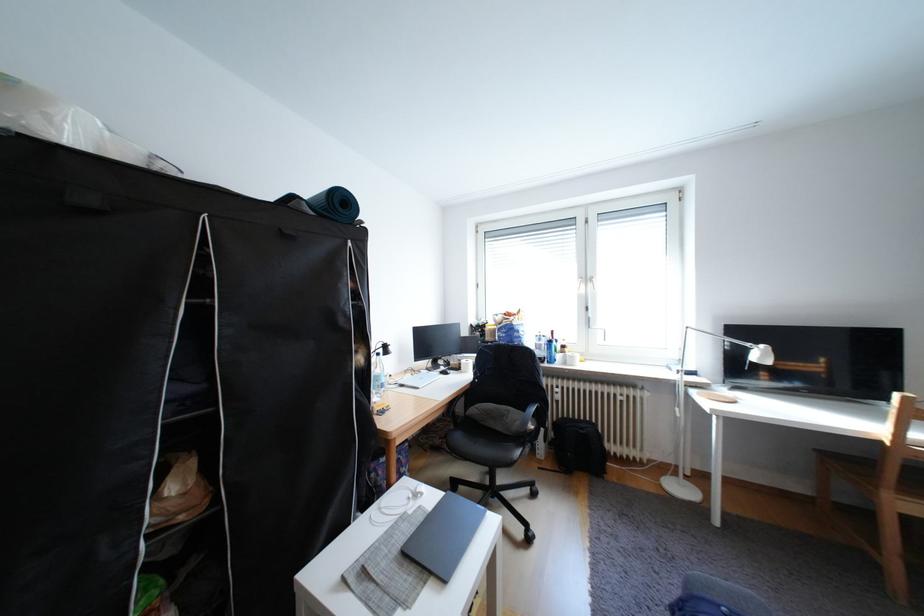
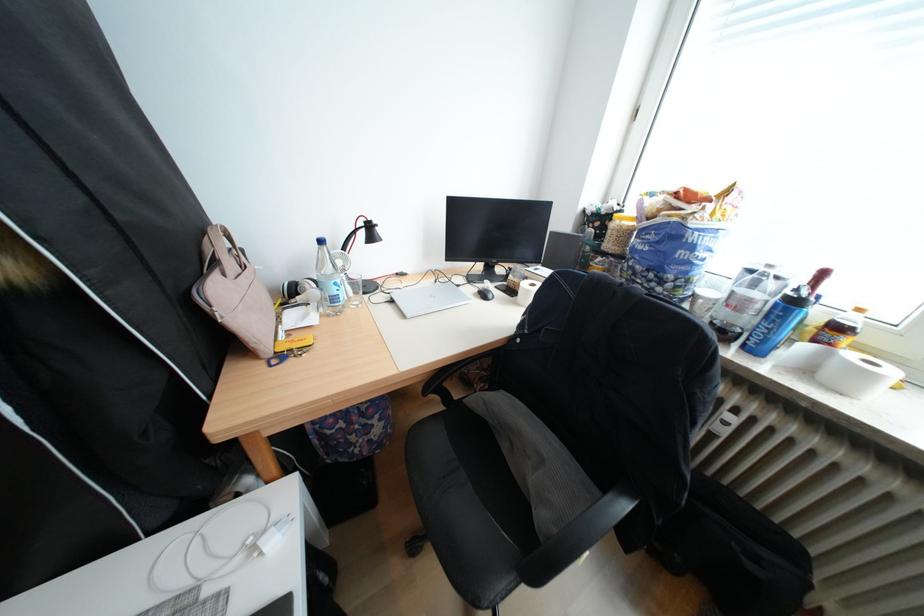
Locate, in the second image, the point that corresponds to (553,341) in the first image.

(767, 285)